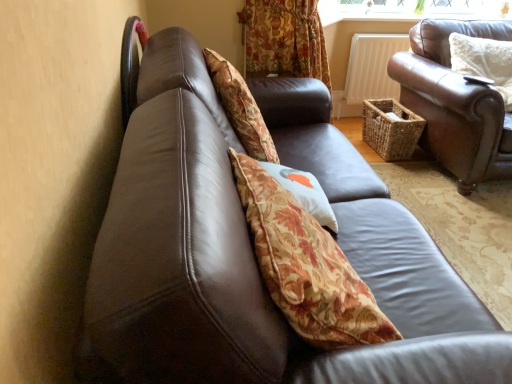
Question: Is brown leather couch at right taller than white fluffy pillow at upper right, placed as the 2th pillow when sorted from front to back?

Choices:
 (A) no
 (B) yes

Answer: (B)

Question: Can you confirm if brown leather couch at right is wider than white fluffy pillow at upper right, placed as the 2th pillow when sorted from front to back?

Choices:
 (A) yes
 (B) no

Answer: (A)

Question: Could white fluffy pillow at upper right, which is the first pillow from right to left, be considered to be inside brown leather couch at right?

Choices:
 (A) yes
 (B) no

Answer: (A)

Question: Considering the relative sizes of brown leather couch at right and white fluffy pillow at upper right, which is the 2th pillow from bottom to top, in the image provided, is brown leather couch at right thinner than white fluffy pillow at upper right, which is the 2th pillow from bottom to top,?

Choices:
 (A) yes
 (B) no

Answer: (B)

Question: Is brown leather couch at right beside white fluffy pillow at upper right, placed as the 2th pillow when sorted from front to back?

Choices:
 (A) no
 (B) yes

Answer: (A)

Question: Is point (136, 79) positioned closer to the camera than point (274, 163)?

Choices:
 (A) farther
 (B) closer

Answer: (A)

Question: From the image's perspective, is shiny black chair at upper left positioned above or below floral fabric cushion at center, which is the 1th pillow from front to back?

Choices:
 (A) below
 (B) above

Answer: (B)

Question: Considering their positions, is shiny black chair at upper left located in front of or behind floral fabric cushion at center, the 2th pillow when ordered from right to left?

Choices:
 (A) front
 (B) behind

Answer: (B)

Question: Is shiny black chair at upper left taller or shorter than floral fabric cushion at center, which appears as the second pillow when viewed from the back?

Choices:
 (A) short
 (B) tall

Answer: (B)

Question: From their relative heights in the image, would you say brown leather couch at right is taller or shorter than shiny black chair at upper left?

Choices:
 (A) short
 (B) tall

Answer: (B)

Question: Is brown leather couch at right inside or outside of shiny black chair at upper left?

Choices:
 (A) inside
 (B) outside

Answer: (B)

Question: In the image, is brown leather couch at right positioned in front of or behind shiny black chair at upper left?

Choices:
 (A) front
 (B) behind

Answer: (B)

Question: Considering the positions of brown leather couch at right and shiny black chair at upper left in the image, is brown leather couch at right bigger or smaller than shiny black chair at upper left?

Choices:
 (A) small
 (B) big

Answer: (B)

Question: From a real-world perspective, relative to white fluffy pillow at upper right, which is the first pillow from right to left, is brown leather couch at right vertically above or below?

Choices:
 (A) below
 (B) above

Answer: (A)

Question: Visually, is brown leather couch at right positioned to the left or to the right of white fluffy pillow at upper right, placed as the 2th pillow when sorted from front to back?

Choices:
 (A) left
 (B) right

Answer: (B)